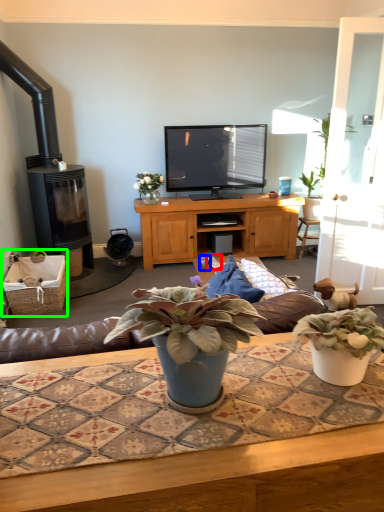
Question: Based on their relative distances, which object is nearer to remote control (highlighted by a red box)? Choose from remote control (highlighted by a blue box) and picnic basket (highlighted by a green box).

Choices:
 (A) remote control
 (B) picnic basket

Answer: (A)